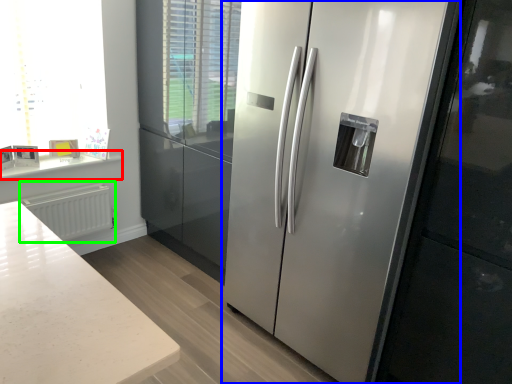
Question: Considering the real-world distances, which object is closest to counter top (highlighted by a red box)? refrigerator (highlighted by a blue box) or radiator (highlighted by a green box).

Choices:
 (A) refrigerator
 (B) radiator

Answer: (B)